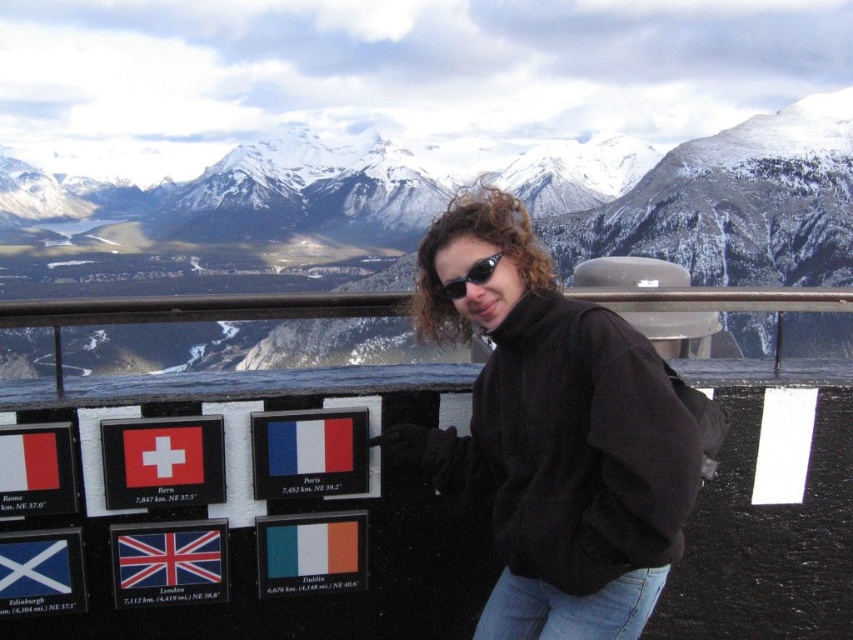
Locate an element on the screen. matte plastic flag at center is located at coordinates (167, 557).

Image resolution: width=853 pixels, height=640 pixels. What do you see at coordinates (167, 557) in the screenshot? I see `matte plastic flag at center` at bounding box center [167, 557].

Where is `matte plastic flag at center`? The image size is (853, 640). matte plastic flag at center is located at coordinates (167, 557).

Is green matte flag at lower center to the left of white fabric flag at center from the viewer's perspective?

In fact, green matte flag at lower center is to the right of white fabric flag at center.

Is green matte flag at lower center closer to camera compared to white fabric flag at center?

No, green matte flag at lower center is behind white fabric flag at center.

Is point (299, 540) less distant than point (135, 464)?

No, (299, 540) is behind (135, 464).

Where is `green matte flag at lower center`? Image resolution: width=853 pixels, height=640 pixels. green matte flag at lower center is located at coordinates (312, 547).

Does point (242, 154) come in front of point (496, 262)?

No, (242, 154) is behind (496, 262).

Between snowy granite mountain at upper center and black plastic sunglasses at center, which one appears on the right side from the viewer's perspective?

Positioned to the right is black plastic sunglasses at center.

Is point (805, 244) closer to viewer compared to point (462, 282)?

That is False.

Where is `snowy granite mountain at upper center`? The image size is (853, 640). snowy granite mountain at upper center is located at coordinates (708, 198).